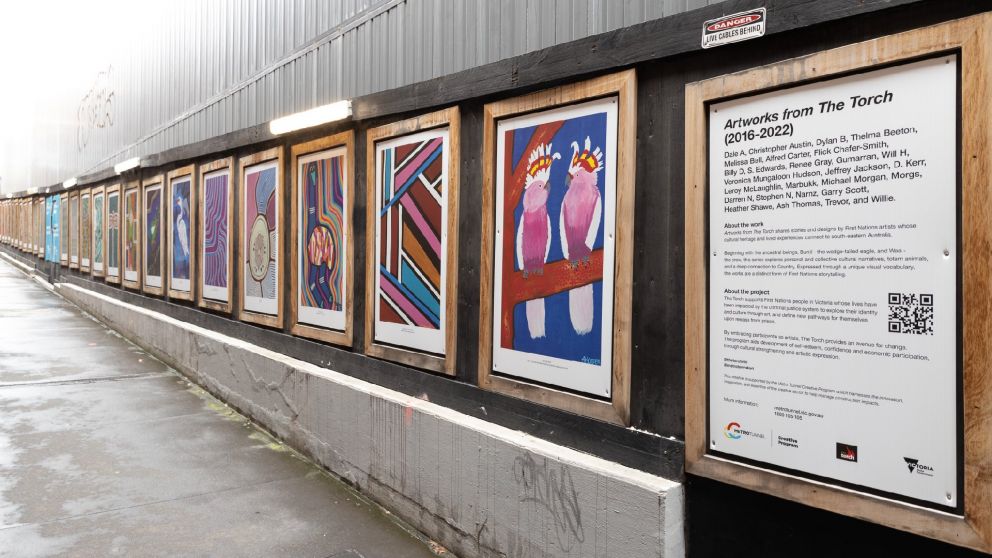
Locate an element on the screen. second nearest light is located at coordinates (131, 165).